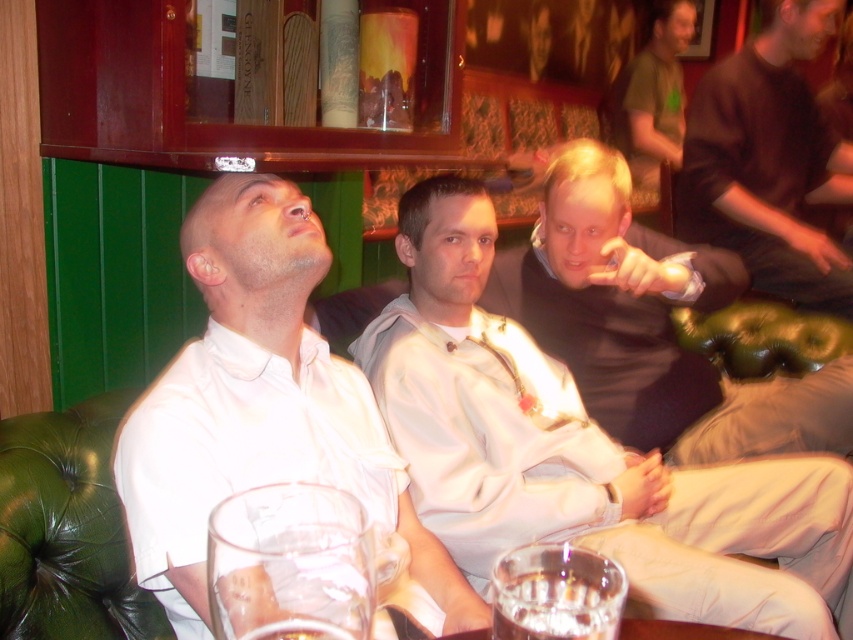
Question: From the image, what is the correct spatial relationship of white shirt at center in relation to clear glass at lower center?

Choices:
 (A) below
 (B) above

Answer: (B)

Question: Is white shirt at center thinner than translucent glass at lower center?

Choices:
 (A) yes
 (B) no

Answer: (B)

Question: Which object appears farthest from the camera in this image?

Choices:
 (A) light beige hoodie at center
 (B) white shirt at center
 (C) translucent glass at lower center

Answer: (A)

Question: Among these points, which one is farthest from the camera?

Choices:
 (A) (337, 632)
 (B) (677, 48)

Answer: (B)

Question: Can you confirm if matte black jacket at center is positioned below translucent glass at lower center?

Choices:
 (A) no
 (B) yes

Answer: (A)

Question: Which object is closer to the camera taking this photo?

Choices:
 (A) dark brown shirt at upper right
 (B) clear glass at lower center
 (C) translucent glass at lower center

Answer: (B)